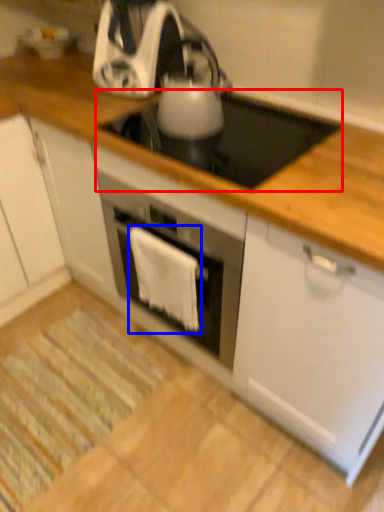
Question: Among these objects, which one is farthest to the camera, gas stove (highlighted by a red box) or cloth (highlighted by a blue box)?

Choices:
 (A) gas stove
 (B) cloth

Answer: (B)